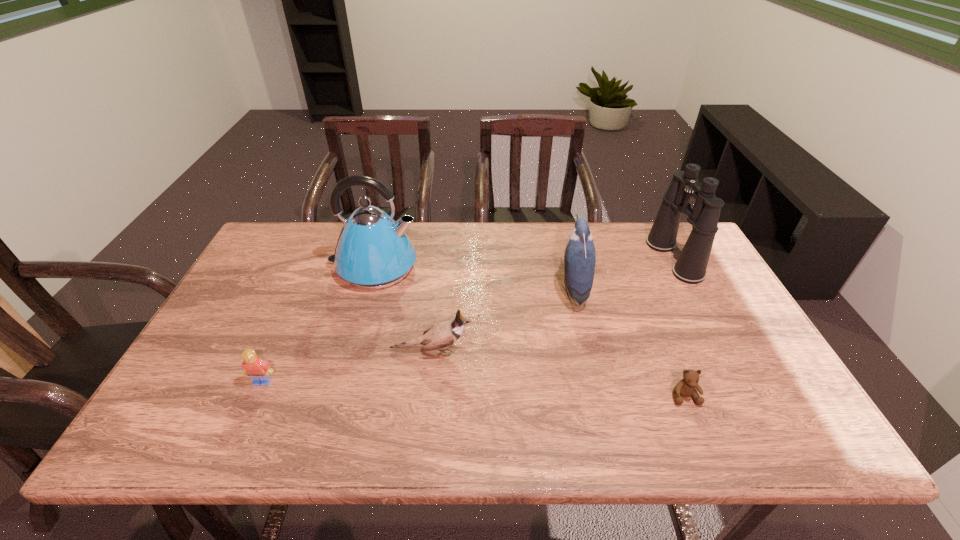
Identify the location of object positioned at the right edge. (691, 266).

Locate an element on the screen. This screenshot has width=960, height=540. object at the far right corner is located at coordinates (691, 266).

This screenshot has height=540, width=960. I want to click on vacant space at the far edge of the desktop, so click(x=459, y=233).

Locate an element on the screen. The height and width of the screenshot is (540, 960). vacant space at the near edge of the desktop is located at coordinates (331, 444).

Identify the location of vacant space at the left edge of the desktop. (248, 329).

Image resolution: width=960 pixels, height=540 pixels. I want to click on blank space at the right edge of the desktop, so click(x=706, y=289).

This screenshot has height=540, width=960. What are the coordinates of `vacant space at the far left corner of the desktop` in the screenshot? It's located at (295, 238).

Image resolution: width=960 pixels, height=540 pixels. I want to click on free space at the far right corner, so click(x=650, y=226).

At what (x,y) coordinates should I click in order to perform the action: click on unoccupied area between the taller bird and the fourth farthest object. Please return your answer as a coordinate pair (x, y). This screenshot has width=960, height=540. Looking at the image, I should click on (502, 320).

Locate an element on the screen. This screenshot has width=960, height=540. vacant space in between the kettle and the nearer bird is located at coordinates (403, 308).